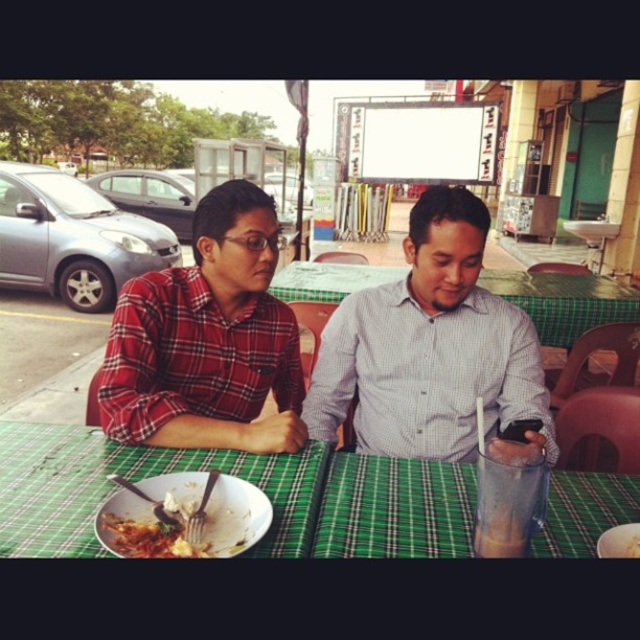
Question: Does white checkered shirt at center have a greater width compared to red plaid shirt at left?

Choices:
 (A) yes
 (B) no

Answer: (A)

Question: Which point is farther to the camera?

Choices:
 (A) (625, 548)
 (B) (236, 545)

Answer: (A)

Question: Does white checkered shirt at center have a greater width compared to red plaid shirt at left?

Choices:
 (A) no
 (B) yes

Answer: (B)

Question: Based on their relative distances, which object is nearer to the green plaid tablecloth at center?

Choices:
 (A) white checkered shirt at center
 (B) white matte plate at center

Answer: (A)

Question: Which object is positioned closest to the white matte plate at center?

Choices:
 (A) green plaid tablecloth at center
 (B) golden crispy pastry at center

Answer: (B)

Question: From the image, what is the correct spatial relationship of green plaid tablecloth at center in relation to red plaid shirt at left?

Choices:
 (A) above
 (B) below

Answer: (B)